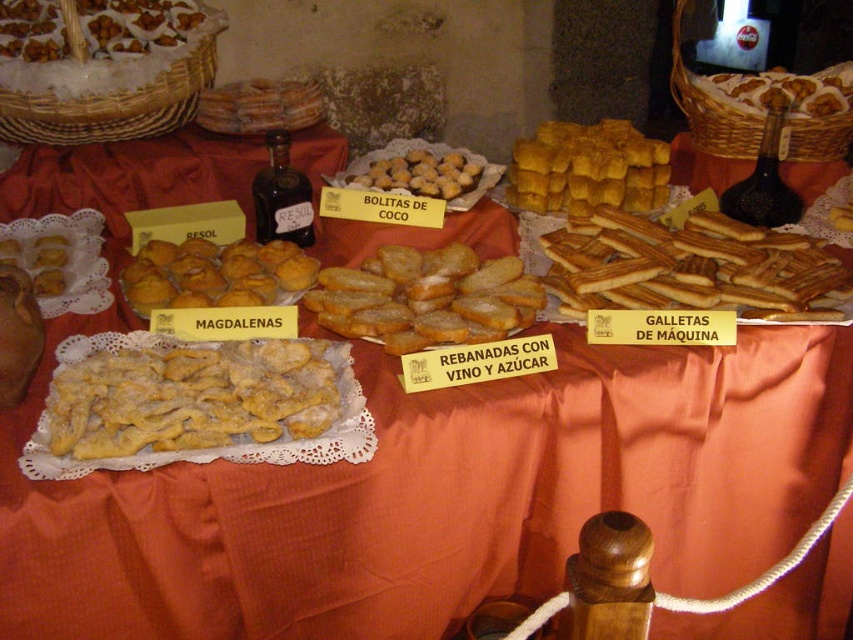
You are a customer at the market and want to buy the golden crumbly muffins at center. The vendor tells you that the muffins are located at coordinates point [213,275]. If you are standing at the origin point 0,0, which direction should you move to reach the muffins?

The golden crumbly muffins at center are located at point [213,275]. Since the coordinates are positive in both x and y directions from the origin 0,0, you should move northeast to reach them.